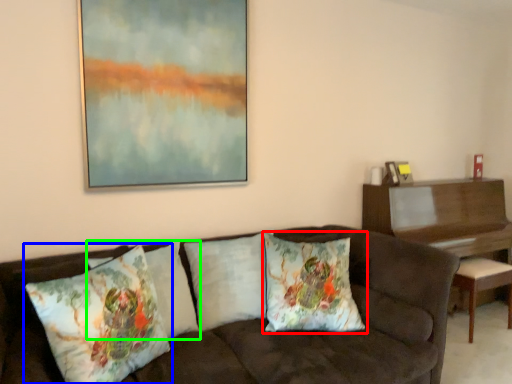
Question: Which object is positioned farthest from pillow (highlighted by a red box)? Select from pillow (highlighted by a blue box) and pillow (highlighted by a green box).

Choices:
 (A) pillow
 (B) pillow

Answer: (A)